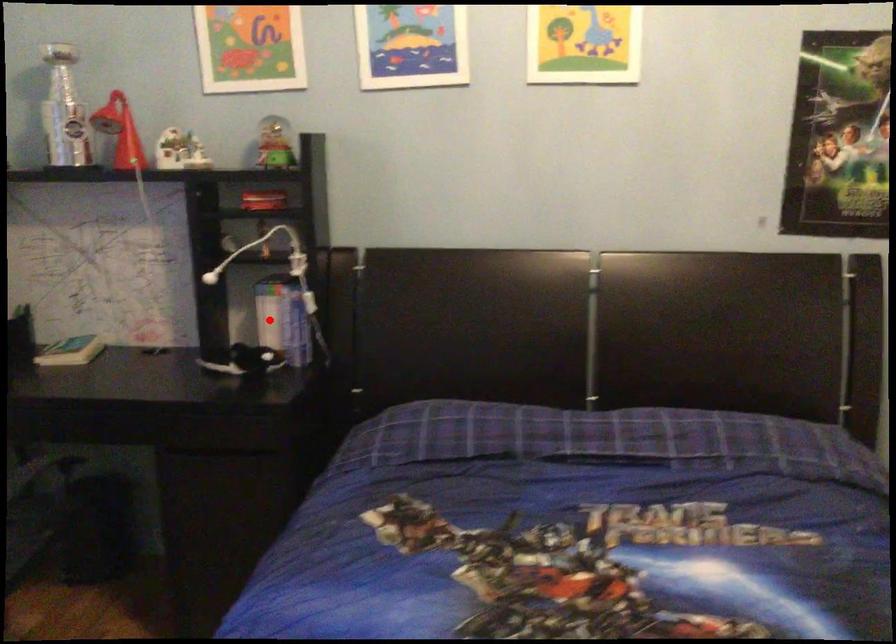
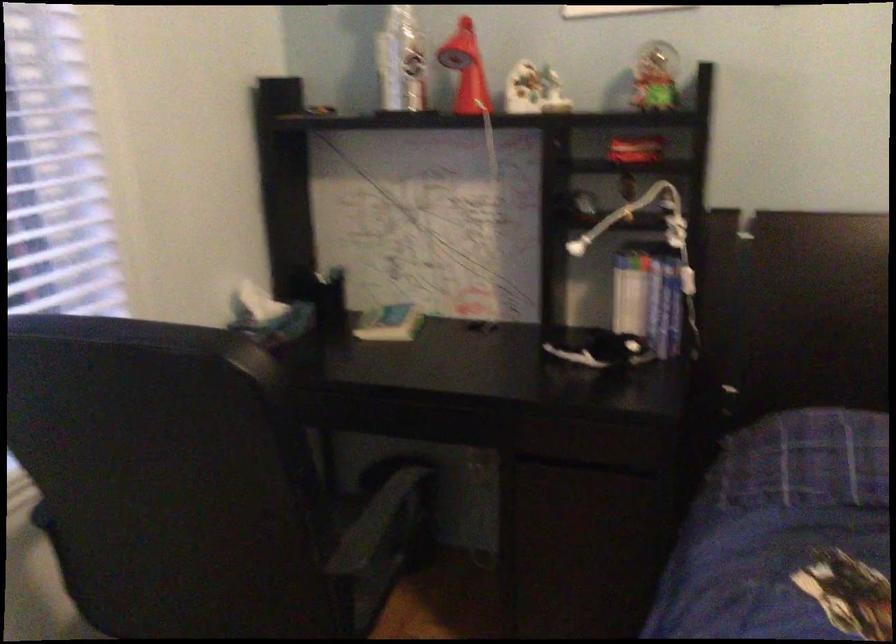
Where in the second image is the point corresponding to the highlighted location from the first image?

(629, 301)